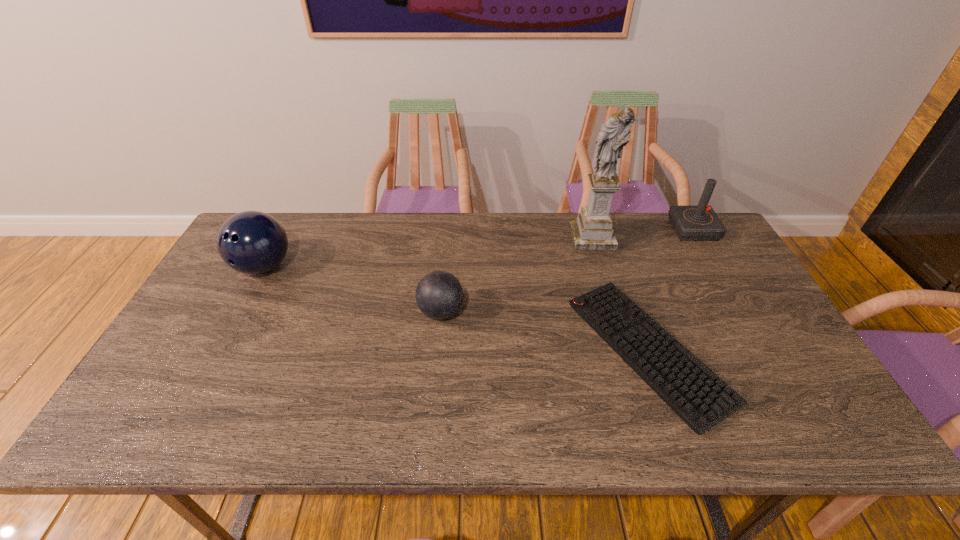
Identify the location of object at the far left corner. (252, 242).

At what (x,y) coordinates should I click in order to perform the action: click on object that is at the far right corner. Please return your answer as a coordinate pair (x, y). This screenshot has height=540, width=960. Looking at the image, I should click on (691, 223).

This screenshot has width=960, height=540. I want to click on free region at the far edge of the desktop, so click(x=328, y=223).

Identify the location of vacant region at the near edge. Image resolution: width=960 pixels, height=540 pixels. (204, 431).

This screenshot has height=540, width=960. Identify the location of vacant space at the left edge of the desktop. (229, 275).

Image resolution: width=960 pixels, height=540 pixels. I want to click on vacant space at the right edge of the desktop, so click(x=793, y=366).

Where is `free space at the near left corner of the desktop`? The height and width of the screenshot is (540, 960). free space at the near left corner of the desktop is located at coordinates (174, 429).

Where is `vacant space at the far right corner of the desktop`? The height and width of the screenshot is (540, 960). vacant space at the far right corner of the desktop is located at coordinates (718, 255).

Locate an element on the screen. vacant area that lies between the joystick and the computer keyboard is located at coordinates (670, 291).

You are a GUI agent. You are given a task and a screenshot of the screen. Output one action in this format:
    pyautogui.click(x=<x>, y=<y>)
    Task: Click on the vacant region between the leftmost object and the joystick
    The height and width of the screenshot is (540, 960).
    Given the screenshot: What is the action you would take?
    pyautogui.click(x=478, y=248)